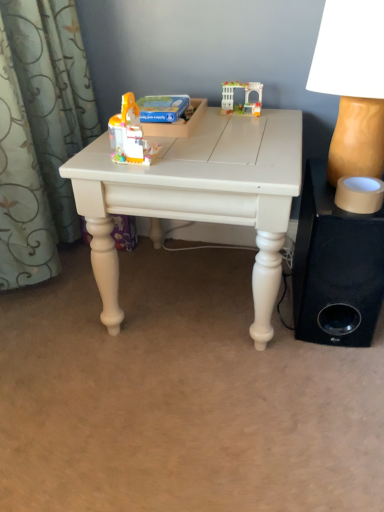
Question: Does black fabric speaker at lower right appear on the left side of white matte table at center?

Choices:
 (A) yes
 (B) no

Answer: (B)

Question: Are black fabric speaker at lower right and white matte table at center beside each other?

Choices:
 (A) no
 (B) yes

Answer: (A)

Question: Can you confirm if black fabric speaker at lower right is thinner than white matte table at center?

Choices:
 (A) yes
 (B) no

Answer: (A)

Question: Does black fabric speaker at lower right have a smaller size compared to white matte table at center?

Choices:
 (A) no
 (B) yes

Answer: (B)

Question: Is black fabric speaker at lower right oriented towards white matte table at center?

Choices:
 (A) yes
 (B) no

Answer: (B)

Question: From a real-world perspective, is matte beige lampshade at right physically located above or below black fabric speaker at lower right?

Choices:
 (A) above
 (B) below

Answer: (A)

Question: In the image, is matte beige lampshade at right positioned in front of or behind black fabric speaker at lower right?

Choices:
 (A) behind
 (B) front

Answer: (B)

Question: Does point (357, 167) appear closer or farther from the camera than point (299, 301)?

Choices:
 (A) farther
 (B) closer

Answer: (B)

Question: Looking at their shapes, would you say matte beige lampshade at right is wider or thinner than black fabric speaker at lower right?

Choices:
 (A) wide
 (B) thin

Answer: (B)

Question: From their relative heights in the image, would you say translucent plastic toy at center, which is the 1th toy in left-to-right order, is taller or shorter than white matte table at center?

Choices:
 (A) short
 (B) tall

Answer: (A)

Question: Which is correct: translucent plastic toy at center, the 2th toy when ordered from right to left, is inside white matte table at center, or outside of it?

Choices:
 (A) outside
 (B) inside

Answer: (A)

Question: Is point pos(114,121) positioned closer to the camera than point pos(228,157)?

Choices:
 (A) farther
 (B) closer

Answer: (B)

Question: Visually, is translucent plastic toy at center, positioned as the 1th toy in front-to-back order, positioned to the left or to the right of white matte table at center?

Choices:
 (A) right
 (B) left

Answer: (B)

Question: Is translucent plastic toy at center, positioned as the 1th toy in front-to-back order, inside or outside of black fabric speaker at lower right?

Choices:
 (A) inside
 (B) outside

Answer: (B)

Question: In terms of width, does translucent plastic toy at center, positioned as the 1th toy in front-to-back order, look wider or thinner when compared to black fabric speaker at lower right?

Choices:
 (A) wide
 (B) thin

Answer: (B)